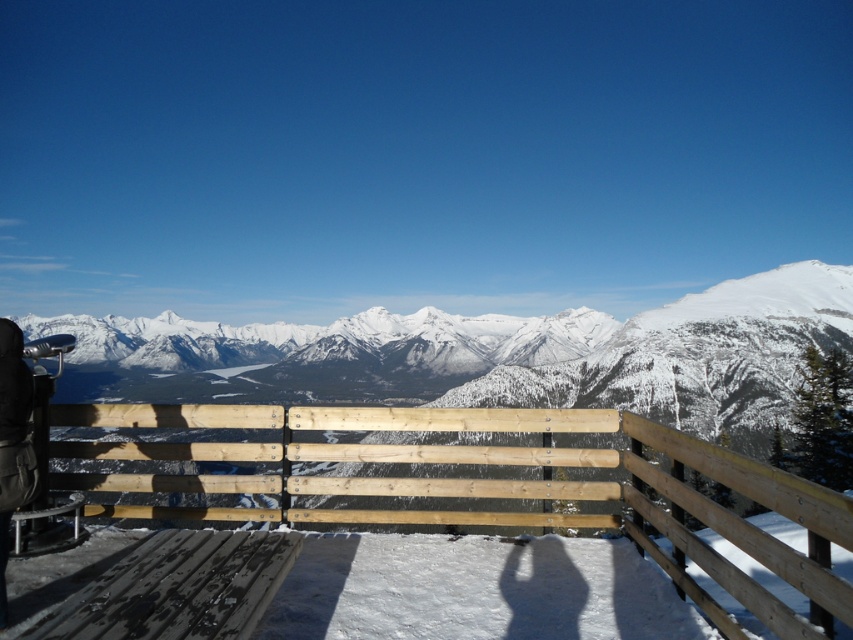
Question: Does light brown wood at center have a smaller size compared to black leather jacket at left?

Choices:
 (A) no
 (B) yes

Answer: (A)

Question: Is light brown wood at center in front of black leather jacket at left?

Choices:
 (A) no
 (B) yes

Answer: (B)

Question: Among these objects, which one is nearest to the camera?

Choices:
 (A) light brown wood at center
 (B) black leather jacket at left

Answer: (A)

Question: Is light brown wood at center bigger than black leather jacket at left?

Choices:
 (A) yes
 (B) no

Answer: (A)

Question: Which point appears farthest from the camera in this image?

Choices:
 (A) (4, 412)
 (B) (762, 604)

Answer: (A)